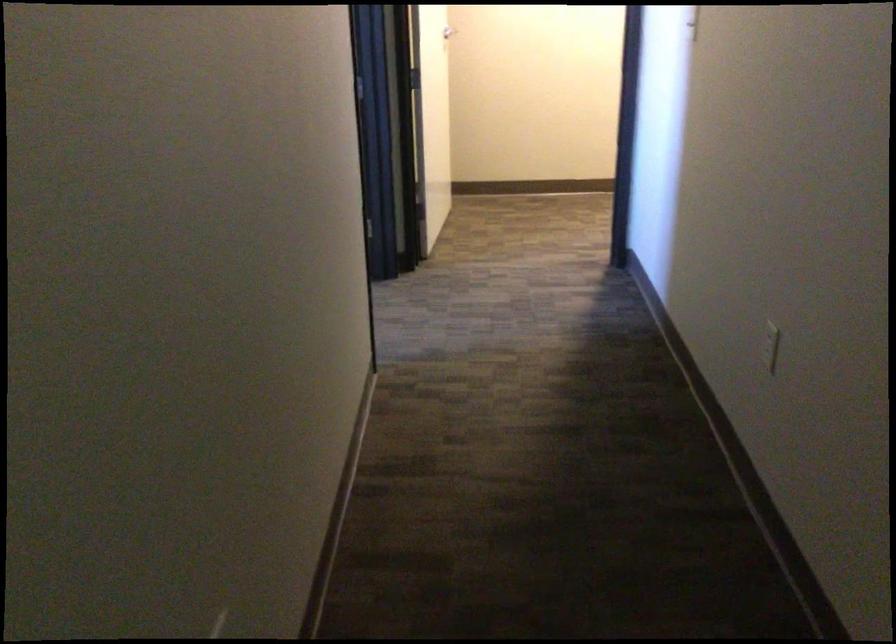
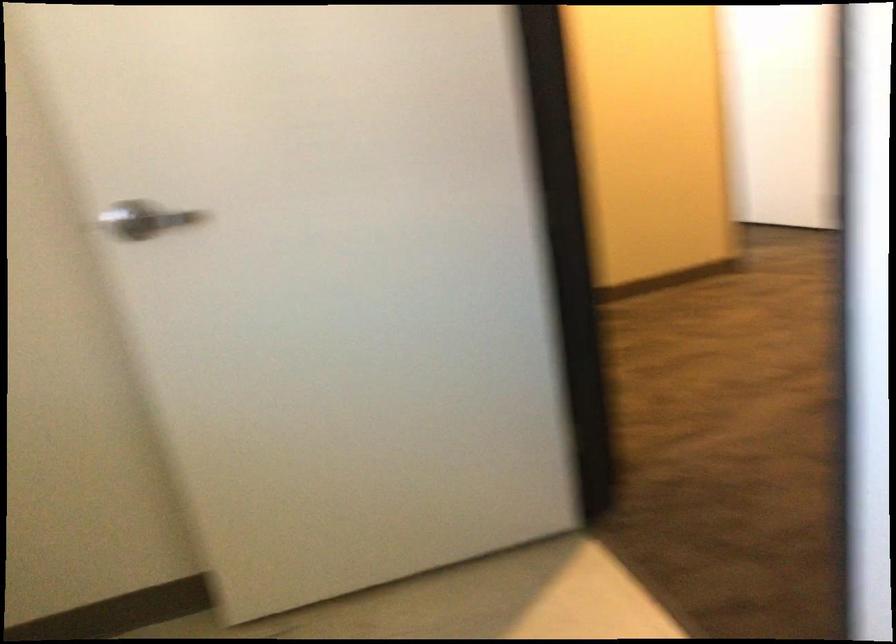
The images are taken continuously from a first-person perspective. In which direction is your viewpoint rotating?

The camera's rotation is toward right-down.